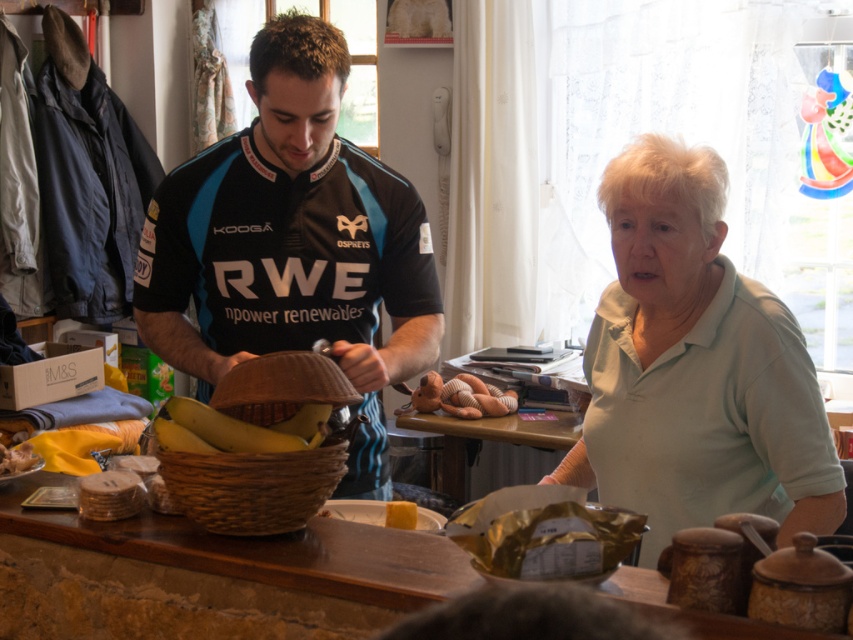
Question: Which object appears farthest from the camera in this image?

Choices:
 (A) yellow wax candle at center
 (B) yellow matte bananas at center
 (C) woven brown basket at center
 (D) woven wood table at center

Answer: (A)

Question: Can you confirm if woven wood table at center is wider than woven brown basket at center?

Choices:
 (A) yes
 (B) no

Answer: (A)

Question: Is matte black jersey at center behind woven brown basket at center?

Choices:
 (A) yes
 (B) no

Answer: (A)

Question: Is black jersey at center bigger than woven wood table at center?

Choices:
 (A) no
 (B) yes

Answer: (B)

Question: Estimate the real-world distances between objects in this image. Which object is farther from the black jersey at center?

Choices:
 (A) yellow wax candle at center
 (B) light green cotton shirt at center
 (C) matte black jersey at center

Answer: (B)

Question: Among these objects, which one is nearest to the camera?

Choices:
 (A) yellow wax candle at center
 (B) black jersey at center

Answer: (B)